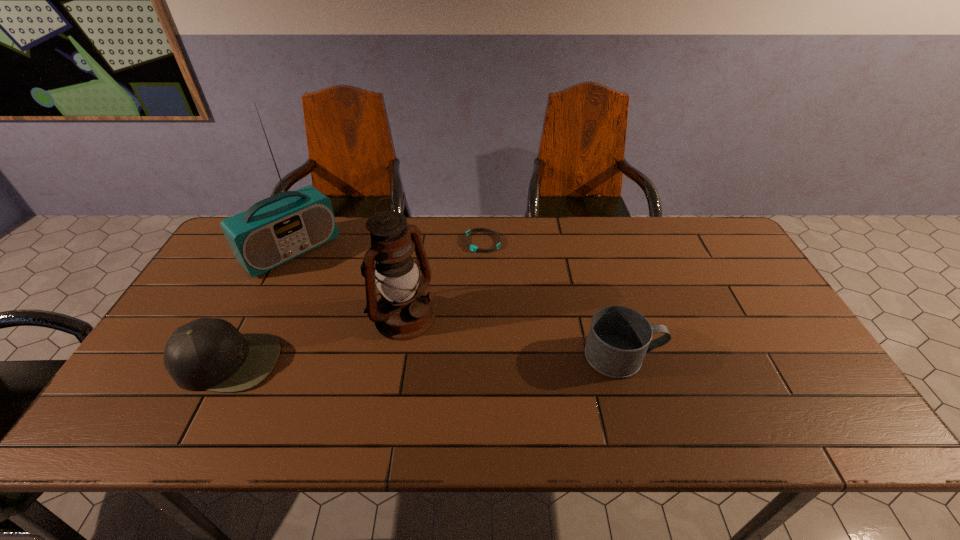
This screenshot has width=960, height=540. Identify the location of vacant space that is in between the cap and the mug. point(425,359).

Where is `free spot between the cap and the mug`? The height and width of the screenshot is (540, 960). free spot between the cap and the mug is located at coordinates (425, 359).

This screenshot has height=540, width=960. In order to click on vacant area that lies between the radio receiver and the lantern in this screenshot , I will do `click(348, 284)`.

Where is `vacant area that lies between the radio receiver and the cap`? vacant area that lies between the radio receiver and the cap is located at coordinates (259, 306).

Locate an element on the screen. unoccupied position between the cap and the shortest object is located at coordinates (355, 302).

At what (x,y) coordinates should I click in order to perform the action: click on vacant space that is in between the wristband and the cap. Please return your answer as a coordinate pair (x, y). Looking at the image, I should click on (355, 302).

Locate an element on the screen. The image size is (960, 540). vacant area between the mug and the cap is located at coordinates click(x=425, y=359).

Where is `empty location between the radio receiver and the rightmost object`? empty location between the radio receiver and the rightmost object is located at coordinates (457, 303).

At what (x,y) coordinates should I click in order to perform the action: click on free space between the mug and the radio receiver. Please return your answer as a coordinate pair (x, y). Image resolution: width=960 pixels, height=540 pixels. Looking at the image, I should click on coord(457,303).

Find the location of a particular element. This screenshot has width=960, height=540. vacant space in between the wristband and the cap is located at coordinates (355, 302).